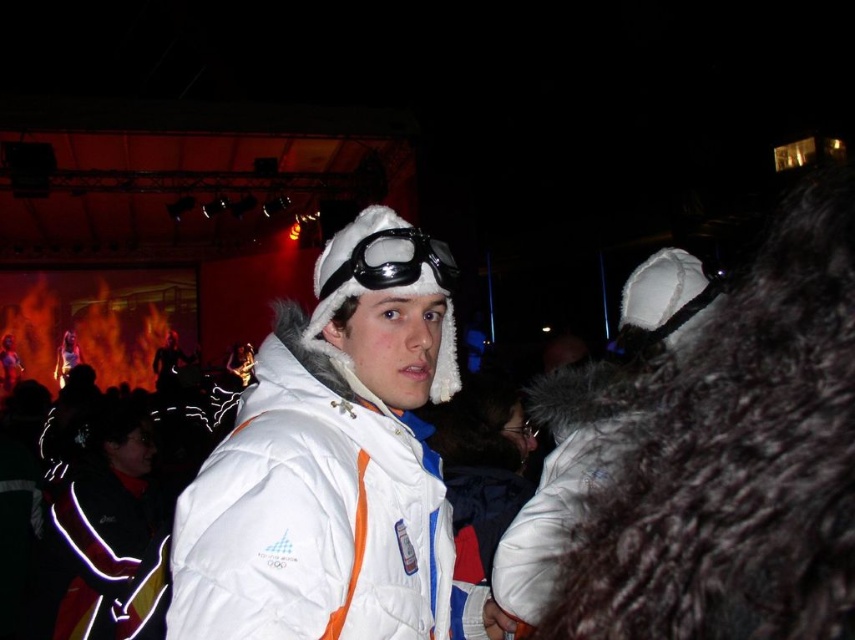
You are standing in the crowd at the event and want to take a photo of both the central figure and the stage. You notice two points in the image labeled as point 1 at coordinate (205, 550) and point 2 at coordinate (623, 346). Which point should you focus on first to ensure both subjects are in focus?

Point 1 at coordinate (205, 550) is closer to the camera than point 2 at coordinate (623, 346). To ensure both the central figure and the stage are in focus, you should focus on point 1 first since it is closer, and the depth of field will naturally include the farther point 2 in the background.

You are a photographer at the event and want to capture both the white puffy jacket at center and the white fur goggles at center in a single photo. Given that your camera has a fixed focus, which object should you prioritize focusing on to ensure it appears clear in the photo?

The white puffy jacket at center is bigger than the white fur goggles at center, so you should prioritize focusing on the white puffy jacket at center to ensure it appears clear in the photo.

You are at a nighttime event and see a person wearing a white puffy jacket at center and white fur goggles at center. Which item is located to the left?

The white puffy jacket at center is positioned on the left side of white fur goggles at center.